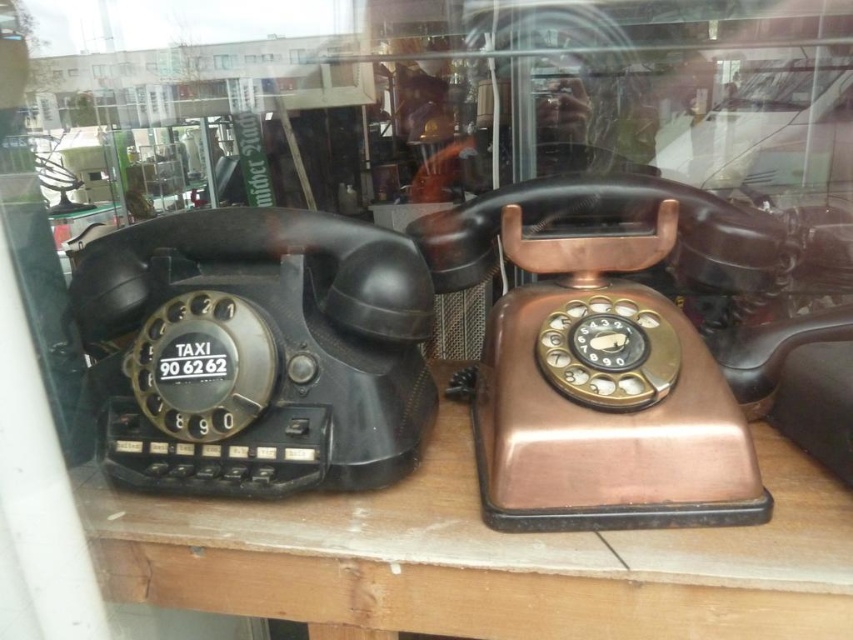
Question: Which point is farther from the camera taking this photo?

Choices:
 (A) (618, 189)
 (B) (277, 380)
 (C) (260, 579)

Answer: (A)

Question: Which object is farther from the camera taking this photo?

Choices:
 (A) copper metallic telephone at center
 (B) brown wood table at center
 (C) matte black telephone at left

Answer: (C)

Question: From the image, what is the correct spatial relationship of brown wood table at center in relation to copper metallic telephone at center?

Choices:
 (A) right
 (B) left

Answer: (B)

Question: Can you confirm if brown wood table at center is smaller than matte black telephone at left?

Choices:
 (A) yes
 (B) no

Answer: (B)

Question: Among these objects, which one is farthest from the camera?

Choices:
 (A) brown wood table at center
 (B) matte black telephone at left
 (C) copper metallic telephone at center

Answer: (B)

Question: Where is matte black telephone at left located in relation to copper metallic telephone at center in the image?

Choices:
 (A) left
 (B) right

Answer: (A)